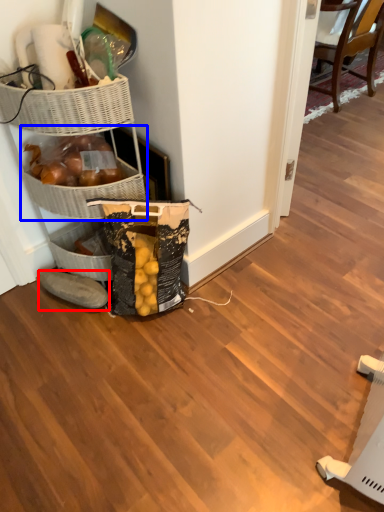
Question: Which object appears closest to the camera in this image, footwear (highlighted by a red box) or basket (highlighted by a blue box)?

Choices:
 (A) footwear
 (B) basket

Answer: (B)